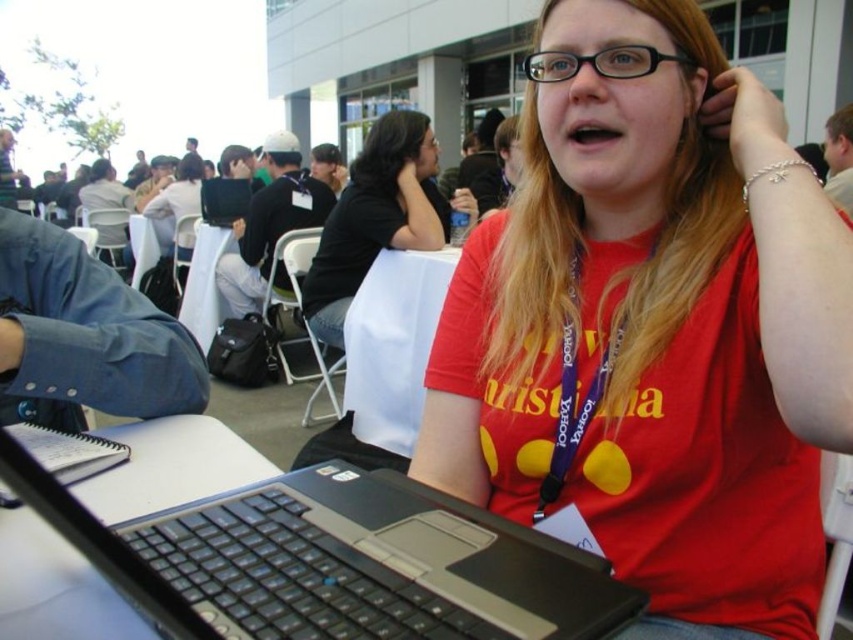
Question: Can you confirm if black plastic laptop at center is bigger than black matte shirt at center?

Choices:
 (A) no
 (B) yes

Answer: (A)

Question: Based on their relative distances, which object is farther from the black plastic laptop at center?

Choices:
 (A) blue fabric lanyard at center
 (B) matte red t-shirt at center

Answer: (A)

Question: Where is black plastic laptop at center located in relation to white fabric table at center in the image?

Choices:
 (A) above
 (B) below

Answer: (B)

Question: Can you confirm if white fabric table at center is positioned below blue fabric lanyard at center?

Choices:
 (A) no
 (B) yes

Answer: (B)

Question: Among these points, which one is farthest from the camera?

Choices:
 (A) (375, 561)
 (B) (589, 394)
 (C) (416, 176)
 (D) (698, 612)

Answer: (C)

Question: Which of these objects is positioned farthest from the matte red t-shirt at center?

Choices:
 (A) blue fabric lanyard at center
 (B) white fabric table at center
 (C) black matte shirt at center
 (D) black plastic laptop at center

Answer: (C)